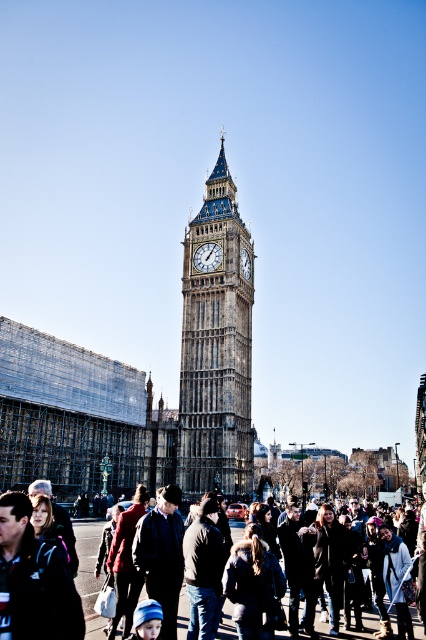
You are a GUI agent. You are given a task and a screenshot of the screen. Output one action in this format:
    pyautogui.click(x=<x>, y=<y>)
    Task: Click on the stone clock tower at center
    The image size is (426, 640).
    Given the screenshot: What is the action you would take?
    pyautogui.click(x=216, y=348)

Between stone clock tower at center and gold textured clock at center, which one has more height?

stone clock tower at center is taller.

This screenshot has width=426, height=640. Describe the element at coordinates (216, 348) in the screenshot. I see `stone clock tower at center` at that location.

This screenshot has height=640, width=426. I want to click on stone clock tower at center, so click(216, 348).

Does stone clock tower at center come in front of dark brown leather jacket at lower center?

That is False.

Is stone clock tower at center smaller than dark brown leather jacket at lower center?

Actually, stone clock tower at center might be larger than dark brown leather jacket at lower center.

Describe the element at coordinates (216, 348) in the screenshot. I see `stone clock tower at center` at that location.

What are the coordinates of `stone clock tower at center` in the screenshot? It's located at (216, 348).

Locate an element on the screen. The image size is (426, 640). dark brown leather jacket at lower center is located at coordinates (89, 573).

Which is in front, point (78, 528) or point (196, 260)?

Positioned in front is point (78, 528).

The height and width of the screenshot is (640, 426). What do you see at coordinates (89, 573) in the screenshot?
I see `dark brown leather jacket at lower center` at bounding box center [89, 573].

In order to click on dark brown leather jacket at lower center in this screenshot , I will do `click(89, 573)`.